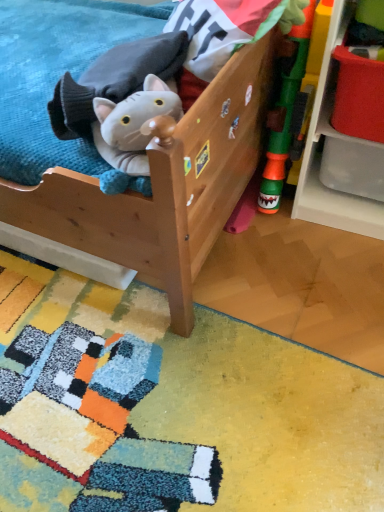
Question: Based on their sizes in the image, would you say fluffy gray plush cat at upper left, which is the first toy from left to right, is bigger or smaller than white plastic shelf at right?

Choices:
 (A) big
 (B) small

Answer: (B)

Question: From the image's perspective, relative to white plastic shelf at right, is fluffy gray plush cat at upper left, the second toy when ordered from right to left, above or below?

Choices:
 (A) below
 (B) above

Answer: (A)

Question: Considering the real-world distances, which object is farthest from the fluffy gray plush cat at upper left, which is the first toy from left to right?

Choices:
 (A) white plastic shelf at right
 (B) rubberized green toy at right, the first toy in the right-to-left sequence
 (C) wooden bed at center

Answer: (A)

Question: Estimate the real-world distances between objects in this image. Which object is farther from the white plastic shelf at right?

Choices:
 (A) wooden bed at center
 (B) fluffy gray plush cat at upper left, which is the first toy from left to right
 (C) rubberized green toy at right, the first toy in the right-to-left sequence

Answer: (B)